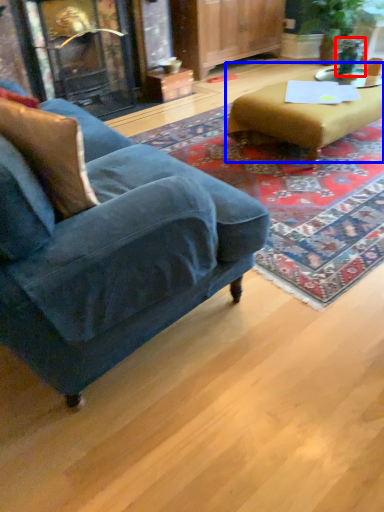
Question: Which object is further to the camera taking this photo, teal (highlighted by a red box) or table (highlighted by a blue box)?

Choices:
 (A) teal
 (B) table

Answer: (A)